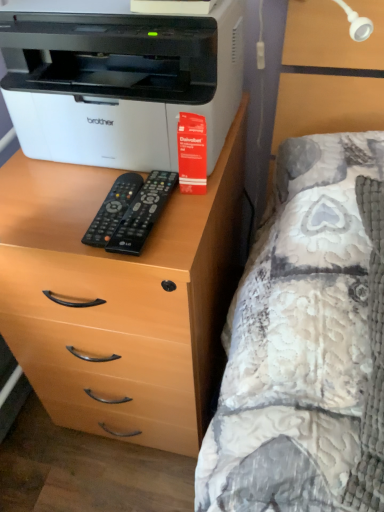
Question: From a real-world perspective, is black plastic remote at center, arranged as the second remote when viewed from the right, positioned above or below light brown wood chest of drawers at left?

Choices:
 (A) below
 (B) above

Answer: (B)

Question: Looking at the image, does black plastic remote at center, arranged as the second remote when viewed from the right, seem bigger or smaller compared to light brown wood chest of drawers at left?

Choices:
 (A) big
 (B) small

Answer: (B)

Question: Based on their relative distances, which object is farther from the fluffy quilted bed at right?

Choices:
 (A) black plastic remote at center, the second remote viewed from the left
 (B) white plastic printer at upper left
 (C) black plastic remote at center, arranged as the second remote when viewed from the right
 (D) light brown wood chest of drawers at left

Answer: (B)

Question: Which is nearer to the light brown wood chest of drawers at left?

Choices:
 (A) black plastic remote at center, the second remote viewed from the left
 (B) white plastic printer at upper left
 (C) fluffy quilted bed at right
 (D) black plastic remote at center, arranged as the first remote when viewed from the left

Answer: (B)